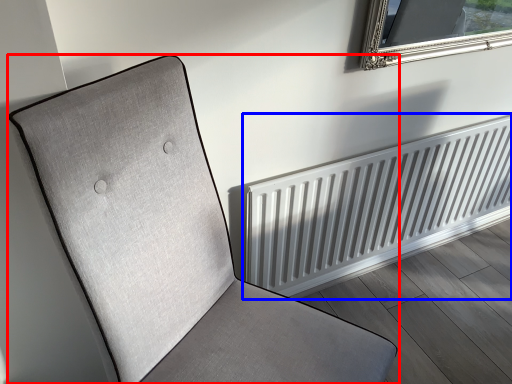
Question: Which object appears closest to the camera in this image, furniture (highlighted by a red box) or radiator (highlighted by a blue box)?

Choices:
 (A) furniture
 (B) radiator

Answer: (A)